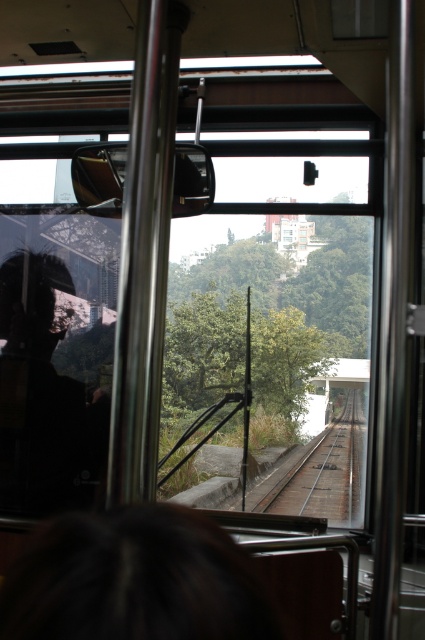
Between silhouette glass at left and brown wooden train track at center, which one is positioned higher?

Positioned higher is silhouette glass at left.

Does point (19, 428) come behind point (331, 506)?

No, it is in front of (331, 506).

At what (x,y) coordinates should I click in order to perform the action: click on silhouette glass at left. Please return your answer as a coordinate pair (x, y). Looking at the image, I should click on (44, 397).

Who is lower down, dark brown hair at lower center or green leafy tree at center?

Positioned lower is dark brown hair at lower center.

Is point (238, 576) positioned after point (223, 355)?

No, it is in front of (223, 355).

Find the location of a particular element. The width and height of the screenshot is (425, 640). dark brown hair at lower center is located at coordinates (133, 580).

Who is taller, dark brown hair at lower center or brown wooden train track at center?

Standing taller between the two is brown wooden train track at center.

Is dark brown hair at lower center below brown wooden train track at center?

No.

What do you see at coordinates (133, 580) in the screenshot? I see `dark brown hair at lower center` at bounding box center [133, 580].

Identify the location of dark brown hair at lower center. (133, 580).